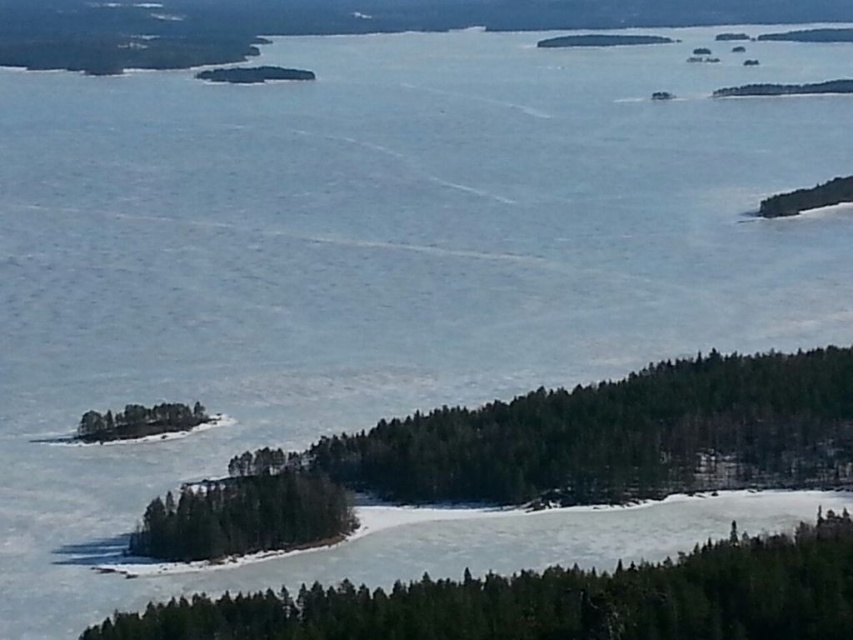
Can you confirm if green matte trees at center is taller than green matte tree at center?

Yes.

Is green matte trees at center thinner than green matte tree at center?

In fact, green matte trees at center might be wider than green matte tree at center.

The image size is (853, 640). I want to click on green matte trees at center, so click(x=538, y=452).

Can you confirm if green matte tree at center is positioned to the right of green matte island at lower left?

Correct, you'll find green matte tree at center to the right of green matte island at lower left.

Which is more to the right, green matte tree at center or green matte island at lower left?

green matte tree at center is more to the right.

Does point (317, 528) lie in front of point (140, 412)?

Yes, it is in front of point (140, 412).

Where is `green matte tree at center`? Image resolution: width=853 pixels, height=640 pixels. green matte tree at center is located at coordinates (242, 516).

Can you confirm if green matte trees at center is positioned below green matte tree at lower center?

No.

Can you confirm if green matte trees at center is positioned above green matte tree at lower center?

Indeed, green matte trees at center is positioned over green matte tree at lower center.

You are a GUI agent. You are given a task and a screenshot of the screen. Output one action in this format:
    pyautogui.click(x=<x>, y=<y>)
    Task: Click on the green matte trees at center
    Image resolution: width=853 pixels, height=640 pixels.
    Given the screenshot: What is the action you would take?
    point(538,452)

Identify the location of green matte trees at center. The image size is (853, 640). (538, 452).